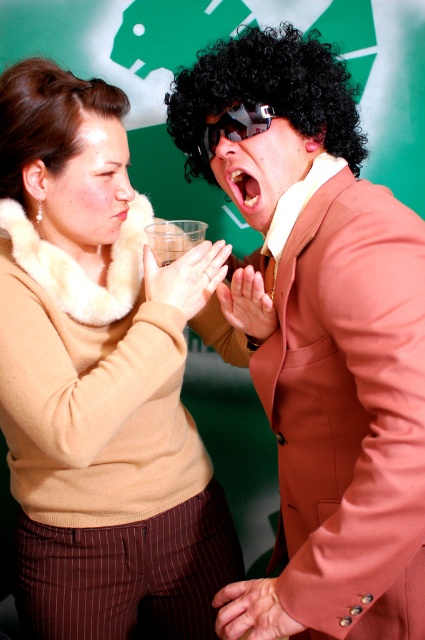
You are a photographer setting up a shoot with two people. You notice there are two black curly wigs in the scene. Which one is positioned closer to you, the photographer, between the black curly wig at center and the black curly wig at upper left?

The black curly wig at center is closer to the viewer than the black curly wig at upper left, so the one at center is closer to you.

You are a photographer who needs to adjust the lighting for the beige fur sweater at center and the black curly wig at upper left. Which object should you focus on first if you want to light the one that is more to the left?

The black curly wig at upper left is more to the left, so you should focus on lighting it first.

You are an assistant analyzing the image. The coordinates point at a specific object in the scene. What object is located at the coordinates point (45, 116)?

The point (45, 116) corresponds to the black curly wig at upper left.